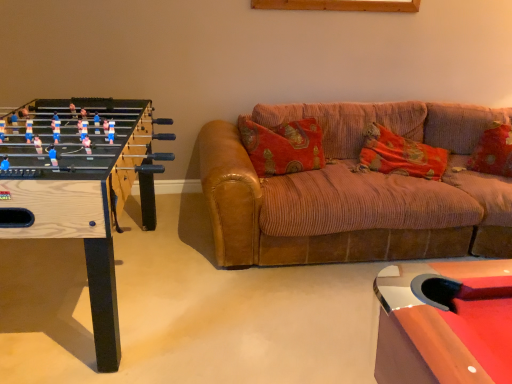
Question: Can you confirm if wooden foosball table at left is bigger than velvet-like red pillow at right, the first pillow viewed from the right?

Choices:
 (A) no
 (B) yes

Answer: (B)

Question: Is the position of wooden foosball table at left less distant than that of velvet-like red pillow at right, the first pillow viewed from the right?

Choices:
 (A) no
 (B) yes

Answer: (B)

Question: Is wooden foosball table at left directly adjacent to velvet-like red pillow at right, which is the second pillow in left-to-right order?

Choices:
 (A) yes
 (B) no

Answer: (B)

Question: Is wooden foosball table at left oriented towards velvet-like red pillow at right, which is the second pillow in left-to-right order?

Choices:
 (A) no
 (B) yes

Answer: (B)

Question: Can we say wooden foosball table at left lies outside velvet-like red pillow at right, the first pillow viewed from the right?

Choices:
 (A) no
 (B) yes

Answer: (B)

Question: Does wooden foosball table at left have a lesser height compared to velvet-like red pillow at right, the first pillow viewed from the right?

Choices:
 (A) no
 (B) yes

Answer: (A)

Question: Does brown corduroy couch at center come behind wooden foosball table at left?

Choices:
 (A) yes
 (B) no

Answer: (A)

Question: Can you confirm if brown corduroy couch at center is shorter than wooden foosball table at left?

Choices:
 (A) no
 (B) yes

Answer: (B)

Question: From the image's perspective, is brown corduroy couch at center above wooden foosball table at left?

Choices:
 (A) no
 (B) yes

Answer: (B)

Question: Would you say brown corduroy couch at center is outside wooden foosball table at left?

Choices:
 (A) yes
 (B) no

Answer: (A)

Question: From the image's perspective, does brown corduroy couch at center appear lower than wooden foosball table at left?

Choices:
 (A) no
 (B) yes

Answer: (A)

Question: Is brown corduroy couch at center positioned far away from wooden foosball table at left?

Choices:
 (A) yes
 (B) no

Answer: (B)

Question: Is velvet-like red pillow at right, the first pillow viewed from the right, closer to the viewer compared to wooden foosball table at left?

Choices:
 (A) yes
 (B) no

Answer: (B)